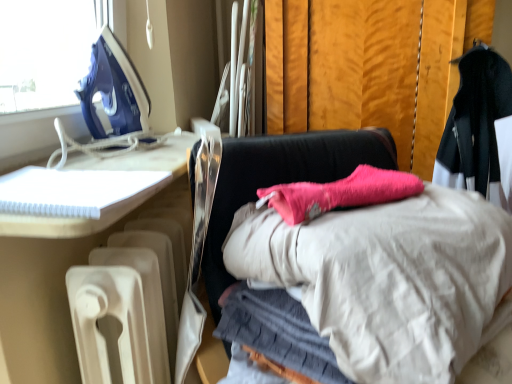
Question: Considering the relative sizes of white plastic radiator at lower left, which ranks as the second furniture in right-to-left order, and white plastic notebook at left, which ranks as the 3th furniture in right-to-left order, in the image provided, is white plastic radiator at lower left, which ranks as the second furniture in right-to-left order, wider than white plastic notebook at left, which ranks as the 3th furniture in right-to-left order,?

Choices:
 (A) yes
 (B) no

Answer: (B)

Question: Is white plastic radiator at lower left, the 2th furniture from the left, placed right next to white plastic notebook at left, which ranks as the 3th furniture in right-to-left order?

Choices:
 (A) no
 (B) yes

Answer: (B)

Question: Considering the relative positions of white plastic radiator at lower left, which ranks as the second furniture in right-to-left order, and white plastic notebook at left, which is counted as the 1th furniture, starting from the left, in the image provided, is white plastic radiator at lower left, which ranks as the second furniture in right-to-left order, to the left of white plastic notebook at left, which is counted as the 1th furniture, starting from the left, from the viewer's perspective?

Choices:
 (A) yes
 (B) no

Answer: (B)

Question: Does white plastic radiator at lower left, which ranks as the second furniture in right-to-left order, contain white plastic notebook at left, which is counted as the 1th furniture, starting from the left?

Choices:
 (A) yes
 (B) no

Answer: (B)

Question: Considering the relative sizes of white plastic radiator at lower left, the 2th furniture from the left, and white plastic notebook at left, which ranks as the 3th furniture in right-to-left order, in the image provided, is white plastic radiator at lower left, the 2th furniture from the left, bigger than white plastic notebook at left, which ranks as the 3th furniture in right-to-left order,?

Choices:
 (A) no
 (B) yes

Answer: (B)

Question: Is white plastic radiator at lower left, the 2th furniture from the left, shorter than white plastic notebook at left, which is counted as the 1th furniture, starting from the left?

Choices:
 (A) yes
 (B) no

Answer: (B)

Question: Does blue plastic iron at upper left appear on the left side of pink fabric at center, which is the 3th furniture from left to right?

Choices:
 (A) yes
 (B) no

Answer: (A)

Question: Is blue plastic iron at upper left closer to the viewer compared to pink fabric at center, which is the 3th furniture from left to right?

Choices:
 (A) no
 (B) yes

Answer: (A)

Question: From a real-world perspective, is blue plastic iron at upper left under pink fabric at center, the first furniture positioned from the right?

Choices:
 (A) no
 (B) yes

Answer: (A)

Question: Is blue plastic iron at upper left not close to pink fabric at center, the first furniture positioned from the right?

Choices:
 (A) yes
 (B) no

Answer: (B)

Question: Is blue plastic iron at upper left completely or partially outside of pink fabric at center, the first furniture positioned from the right?

Choices:
 (A) yes
 (B) no

Answer: (A)

Question: From the image's perspective, is blue plastic iron at upper left located above pink fabric at center, the first furniture positioned from the right?

Choices:
 (A) yes
 (B) no

Answer: (A)

Question: From a real-world perspective, does white plastic radiator at lower left, the 2th furniture from the left, stand above pink fabric at center, which is the 3th furniture from left to right?

Choices:
 (A) yes
 (B) no

Answer: (B)